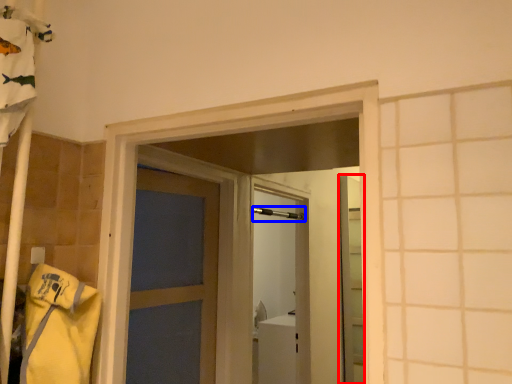
Question: Which point is further to the camera, elevator (highlighted by a red box) or shower (highlighted by a blue box)?

Choices:
 (A) elevator
 (B) shower

Answer: (A)